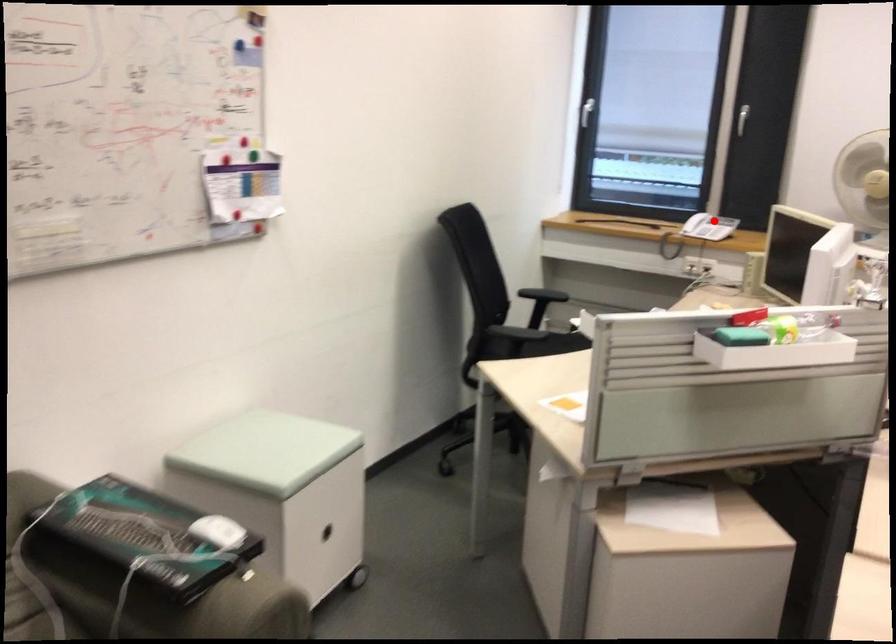
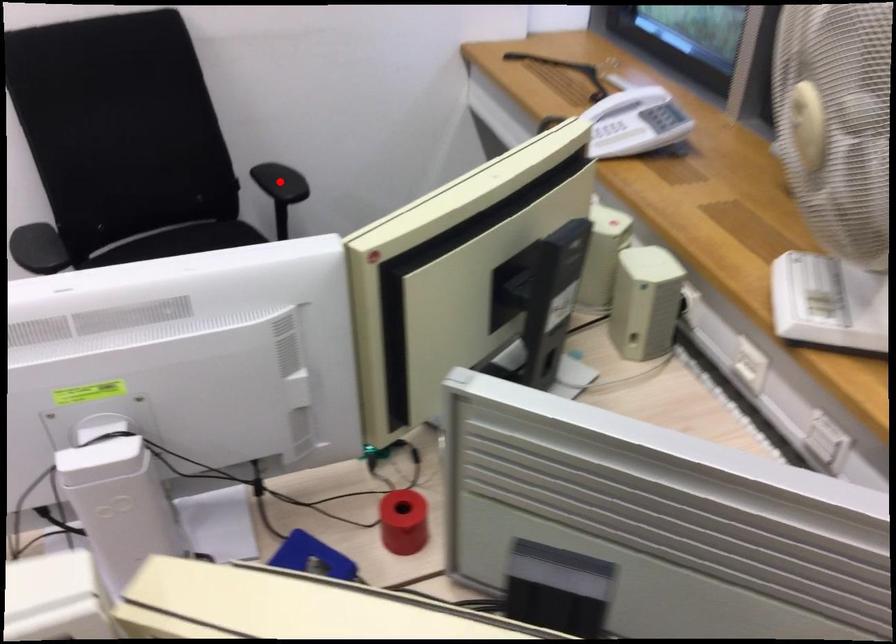
I am providing you with two images of the same scene from different viewpoints. A red point is marked on the first image and another point is marked on the second image. Are the points marked in image1 and image2 representing the same 3D position?

No